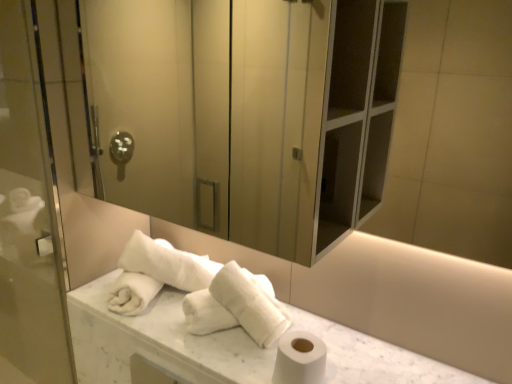
Find the location of `vacant space situated on the left part of white matte toilet paper at lower right`. vacant space situated on the left part of white matte toilet paper at lower right is located at coordinates (227, 363).